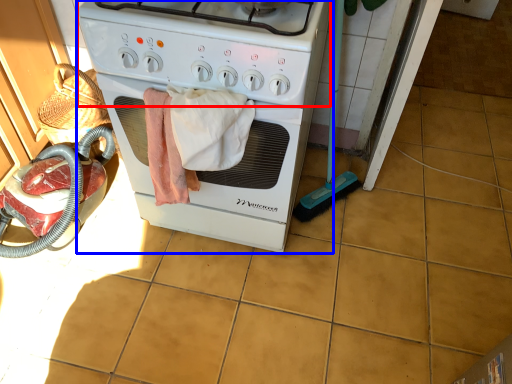
Question: Which point is further to the camera, gas stove (highlighted by a red box) or home appliance (highlighted by a blue box)?

Choices:
 (A) gas stove
 (B) home appliance

Answer: (B)